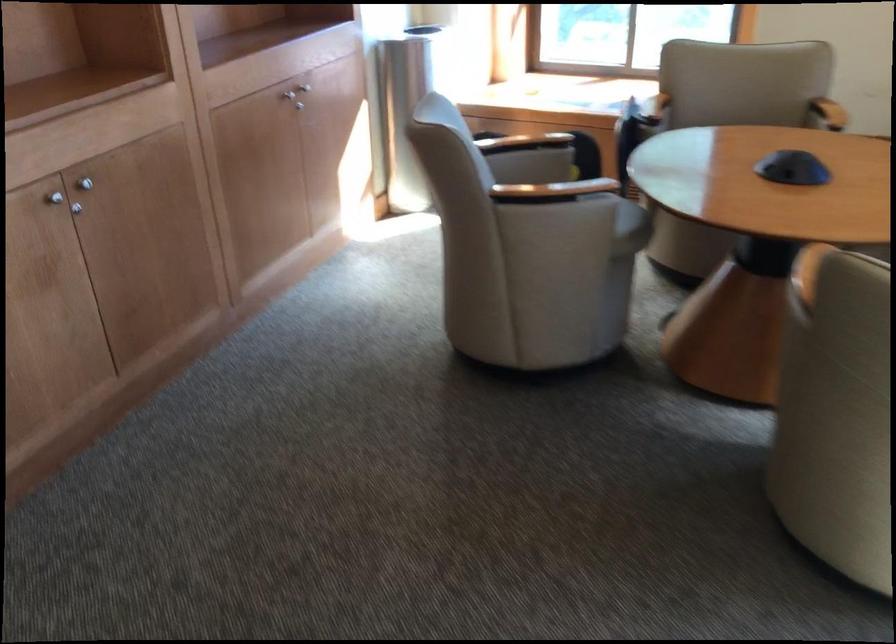
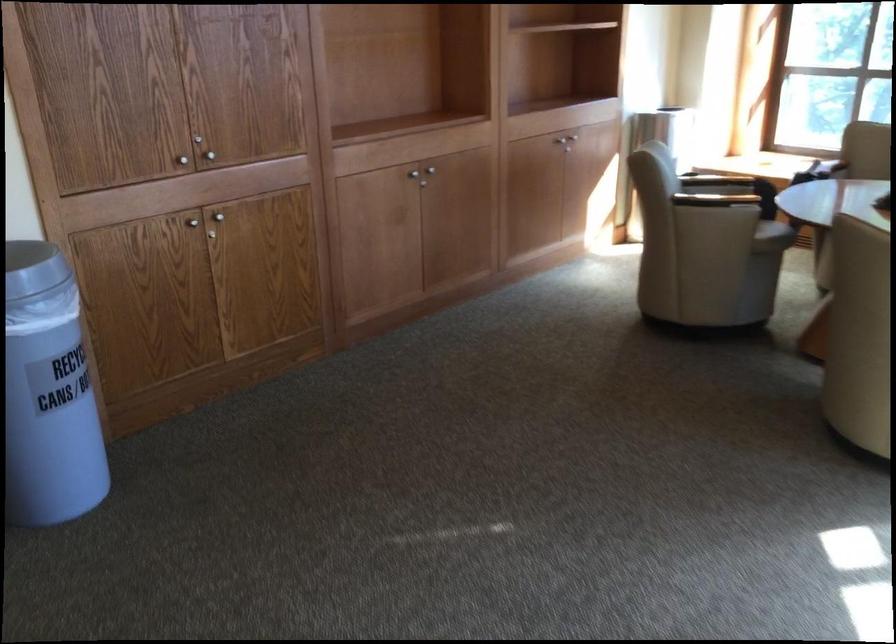
Locate, in the second image, the point that corresponds to the point at 564,202 in the first image.

(726, 202)